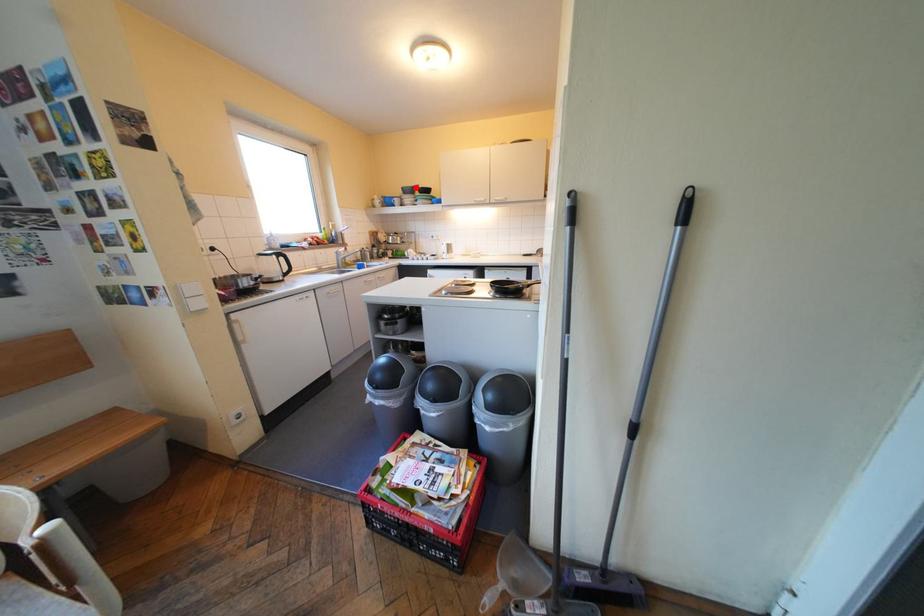
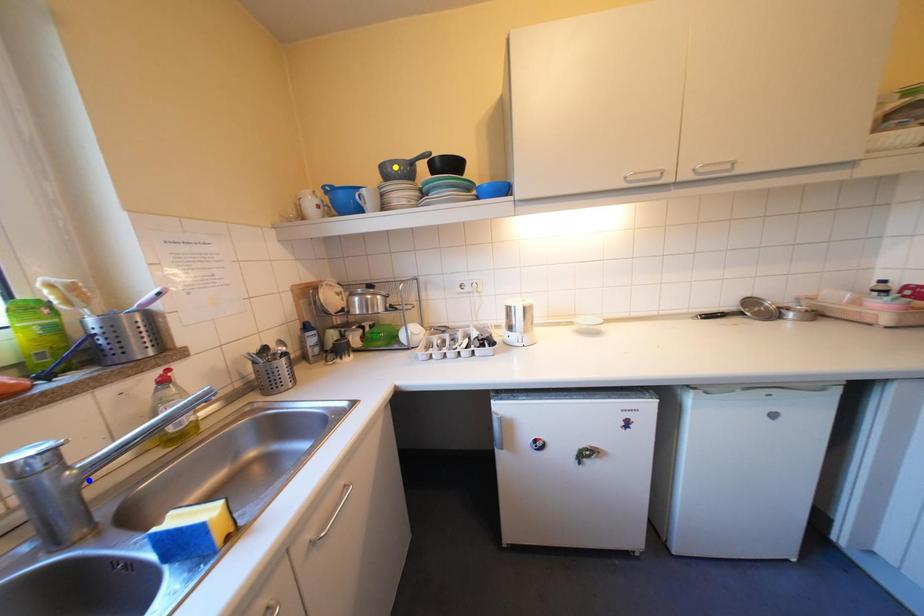
Question: I am providing you with two images of the same scene from different viewpoints. A red point is marked on the first image. You are given multiple points on the second image. Can you choose the point in image 2 that corresponds to the point in image 1?

Choices:
 (A) blue point
 (B) green point
 (C) yellow point

Answer: (C)